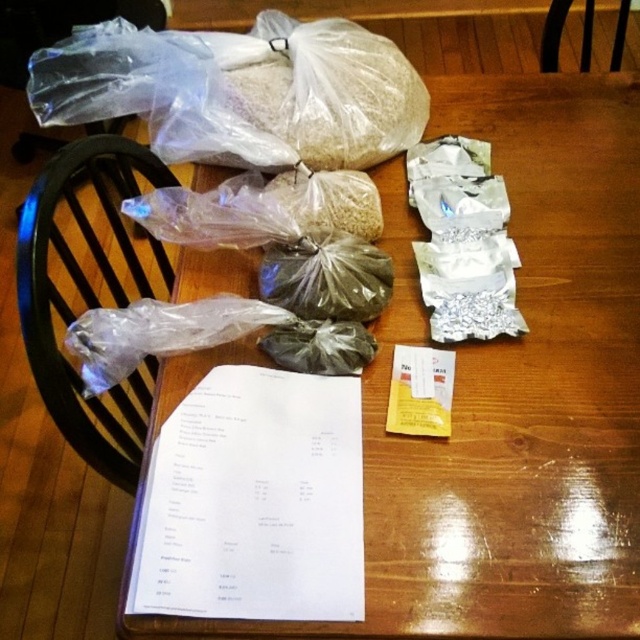
You are standing at the edge of the table looking at the items. There are two points marked on the table surface labeled as point (154, 253) and point (92, 392). If you were to move from one point to the other, which point would you reach first if you move towards the back of the table?

You would reach point (92, 392) first because point (154, 253) is behind it, meaning it is closer to the back of the table.

You are standing in front of the wooden table and want to reach a point that is 27.94 inches away from you. Can you confirm if the point you are aiming for is exactly at the coordinates point (x=38, y=289)?

Yes, the point (x=38, y=289) is exactly 27.94 inches away from the camera, so it matches the distance you are aiming for.